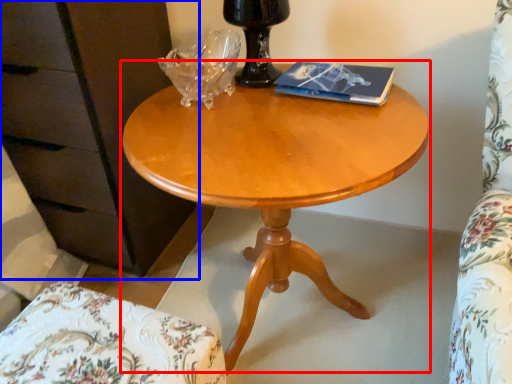
Question: Which point is closer to the camera, coffee table (highlighted by a red box) or dresser (highlighted by a blue box)?

Choices:
 (A) coffee table
 (B) dresser

Answer: (A)